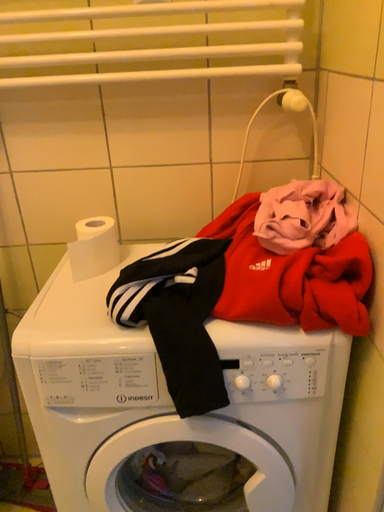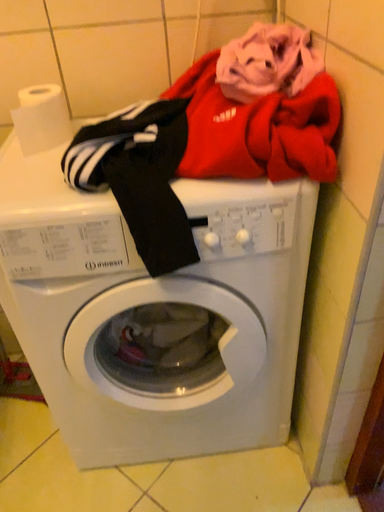
Question: Which way did the camera rotate in the video?

Choices:
 (A) rotated upward
 (B) rotated downward

Answer: (B)